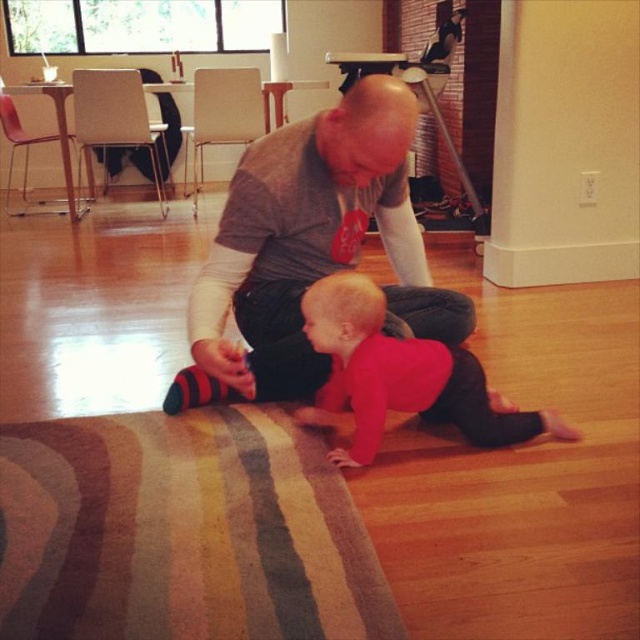
Question: Which point is closer to the camera?

Choices:
 (A) (337, 104)
 (B) (358, 460)

Answer: (B)

Question: Does gray cotton shirt at center have a larger size compared to matte red shirt at center?

Choices:
 (A) no
 (B) yes

Answer: (B)

Question: Can you confirm if gray cotton shirt at center is bigger than matte red shirt at center?

Choices:
 (A) yes
 (B) no

Answer: (A)

Question: Can you confirm if gray cotton shirt at center is positioned above matte red shirt at center?

Choices:
 (A) no
 (B) yes

Answer: (B)